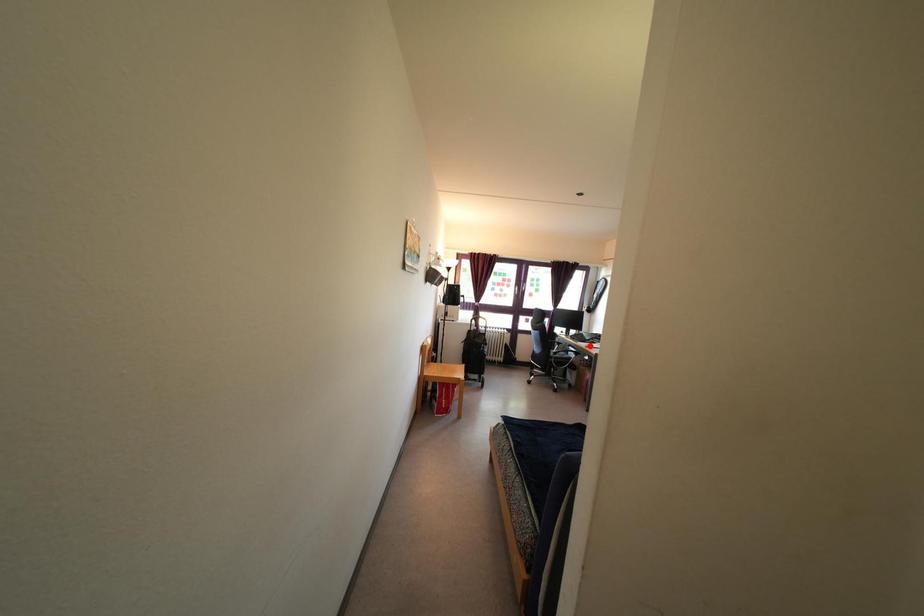
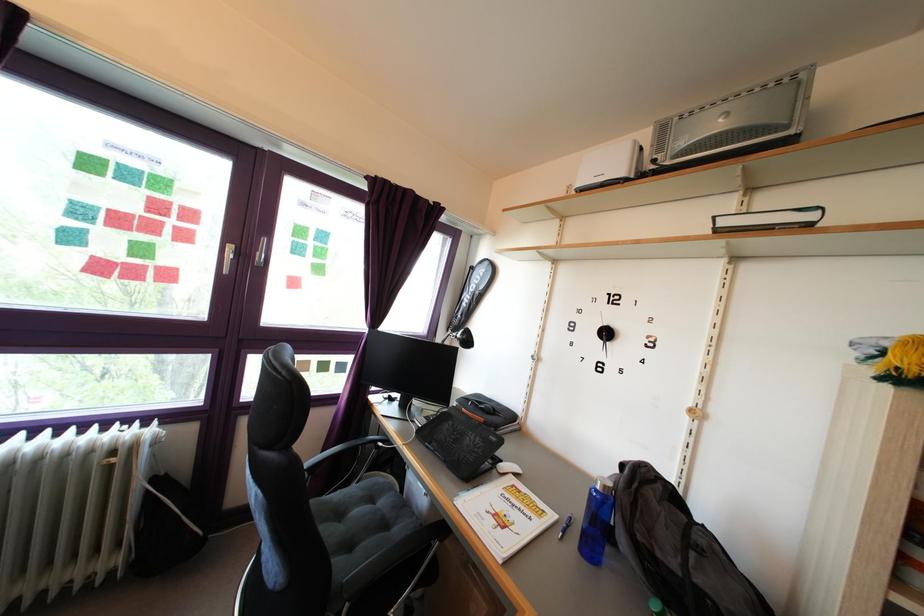
In the second image, find the point that corresponds to the highlighted location in the first image.

(472, 447)